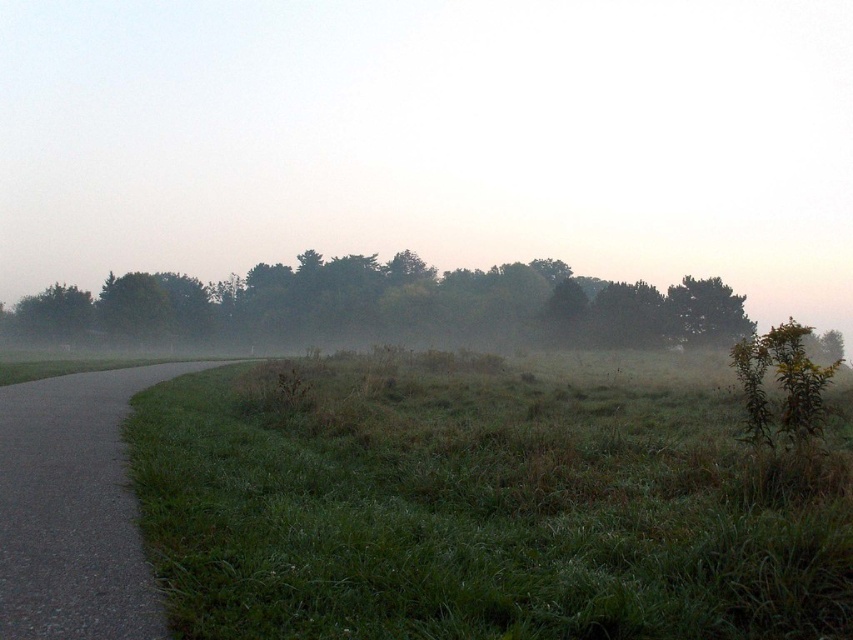
You are a hiker who wants to walk from the gray asphalt path at left to the green matte trees at center. Given that your average walking speed is 1.4 meters per second, how long will it take you to reach the trees?

The distance between the gray asphalt path at left and the green matte trees at center is 71.67 meters. At a walking speed of 1.4 meters per second, it would take approximately 51.2 seconds to reach the trees.

You are standing at the point marked as point (479, 508) in the image. What is the name of the object directly beneath your feet?

The green grassy at lower left is located at point (479, 508), so the object directly beneath your feet is the green grassy at lower left.